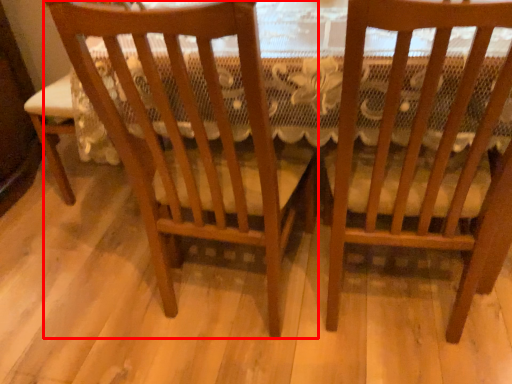
Question: In this image, where is chair (annotated by the red box) located relative to chair?

Choices:
 (A) right
 (B) left

Answer: (B)